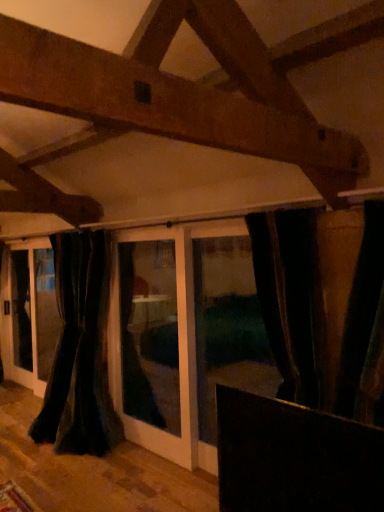
The image size is (384, 512). What do you see at coordinates (80, 351) in the screenshot? I see `velvet dark curtain at lower left` at bounding box center [80, 351].

Locate an element on the screen. The image size is (384, 512). velvet dark curtain at lower left is located at coordinates (80, 351).

The image size is (384, 512). What are the coordinates of `velvet dark curtain at lower left` in the screenshot? It's located at (80, 351).